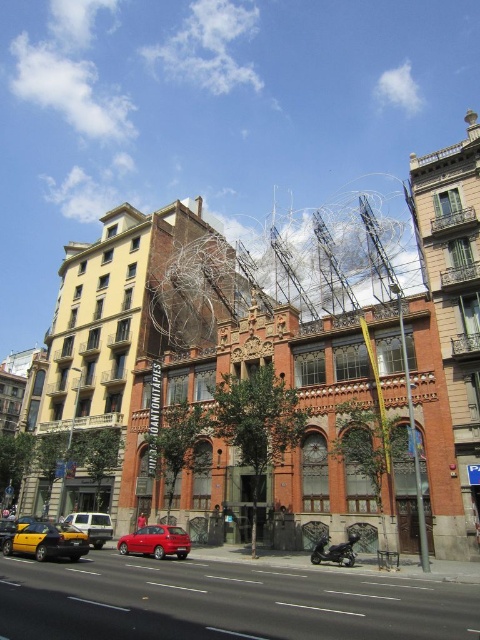
In the scene shown: Which of these two, yellow matte taxi at lower left or shiny red sedan at center, stands taller?

Standing taller between the two is shiny red sedan at center.

The height and width of the screenshot is (640, 480). What are the coordinates of `yellow matte taxi at lower left` in the screenshot? It's located at (48, 541).

Where is `yellow matte taxi at lower left`? Image resolution: width=480 pixels, height=640 pixels. yellow matte taxi at lower left is located at coordinates (48, 541).

At what (x,y) coordinates should I click in order to perform the action: click on shiny red sedan at center. Please return your answer as a coordinate pair (x, y). Looking at the image, I should click on (156, 541).

Which is behind, point (169, 538) or point (79, 524)?

Positioned behind is point (79, 524).

The image size is (480, 640). I want to click on shiny red sedan at center, so click(x=156, y=541).

Is yellow matte taxi at lower left closer to the viewer compared to matte silver van at center?

Yes, yellow matte taxi at lower left is closer to the viewer.

Who is shorter, yellow matte taxi at lower left or matte silver van at center?

yellow matte taxi at lower left is shorter.

Identify the location of yellow matte taxi at lower left. (48, 541).